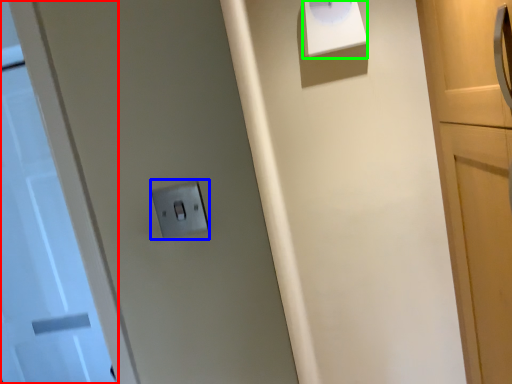
Question: Estimate the real-world distances between objects in this image. Which object is farther from door (highlighted by a red box), light switch (highlighted by a blue box) or wide (highlighted by a green box)?

Choices:
 (A) light switch
 (B) wide

Answer: (A)